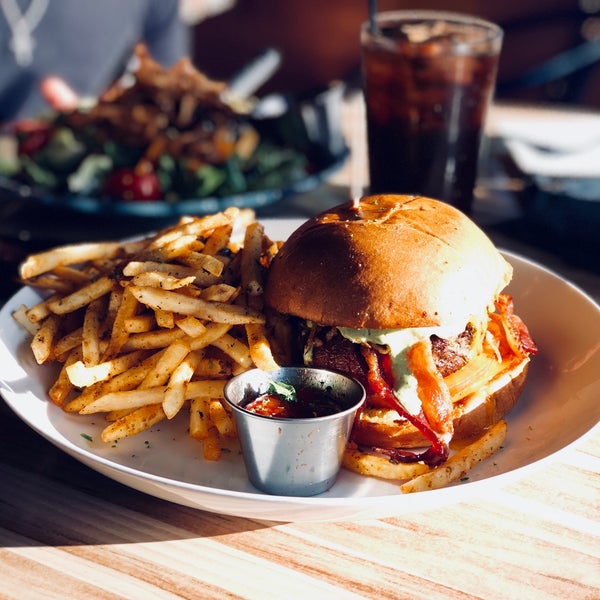
Where is `metal container of ketchup`? Image resolution: width=600 pixels, height=600 pixels. metal container of ketchup is located at coordinates (304, 458).